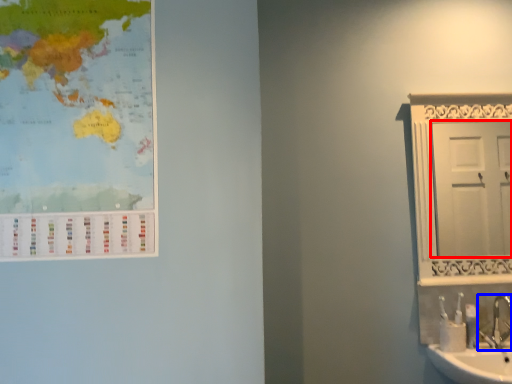
Question: Among these objects, which one is nearest to the camera, door (highlighted by a red box) or tap (highlighted by a blue box)?

Choices:
 (A) door
 (B) tap

Answer: (B)